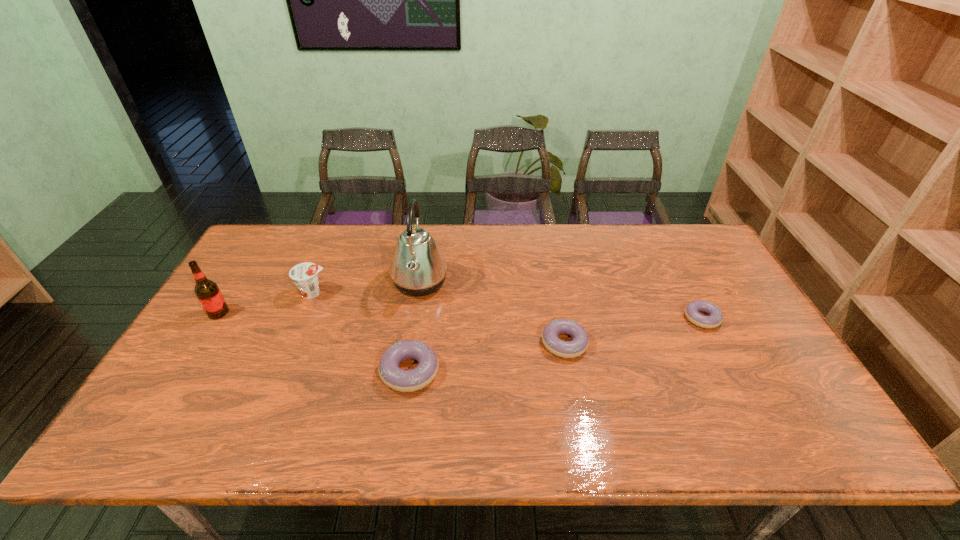
Please point a vacant point for placing a doughnut on the left. Please provide its 2D coordinates. Your answer should be formatted as a tuple, i.e. [(x, y)], where the tuple contains the x and y coordinates of a point satisfying the conditions above.

[(234, 403)]